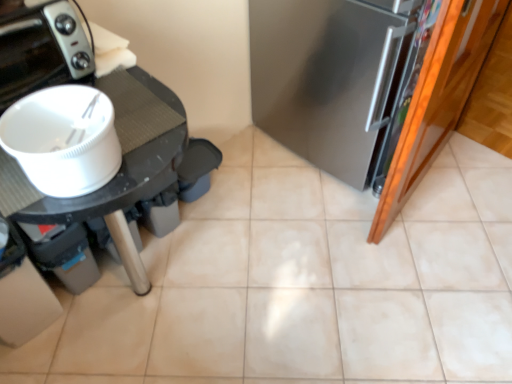
Question: In the image, is white plastic table at left positioned in front of or behind black glossy toaster at upper left?

Choices:
 (A) front
 (B) behind

Answer: (A)

Question: Based on their positions, is white plastic table at left located to the left or right of black glossy toaster at upper left?

Choices:
 (A) right
 (B) left

Answer: (A)

Question: Estimate the real-world distances between objects in this image. Which object is closer to the black glossy toaster at upper left?

Choices:
 (A) white matte bowl at left
 (B) white plastic table at left
 (C) satin silver refrigerator at right
 (D) beige ceramic tile at center

Answer: (B)

Question: Which is farther from the white plastic table at left?

Choices:
 (A) black glossy toaster at upper left
 (B) beige ceramic tile at center
 (C) satin silver refrigerator at right
 (D) white matte bowl at left

Answer: (B)